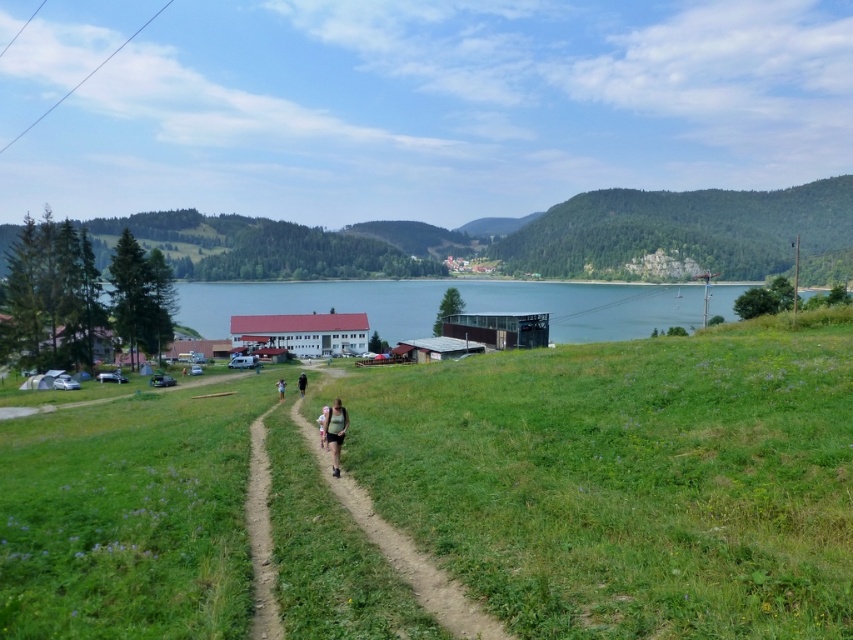
Question: Is matte green tank top at center wider than light blue fabric at center?

Choices:
 (A) no
 (B) yes

Answer: (A)

Question: Which point is closer to the camera?

Choices:
 (A) coord(276,289)
 (B) coord(785,486)

Answer: (B)

Question: Is the position of blue glass water at center more distant than that of light brown fabric shirt at center?

Choices:
 (A) no
 (B) yes

Answer: (B)

Question: Which point is farther to the camera?

Choices:
 (A) light blue fabric at center
 (B) blue glass water at center
 (C) brown dirt path at center
 (D) green grassy field at center

Answer: (B)

Question: Which object appears closest to the camera in this image?

Choices:
 (A) green grassy field at center
 (B) black fabric person at center
 (C) light brown fabric shirt at center

Answer: (A)

Question: Can you confirm if green forested hillside at upper right is positioned to the right of black fabric person at center?

Choices:
 (A) no
 (B) yes

Answer: (B)